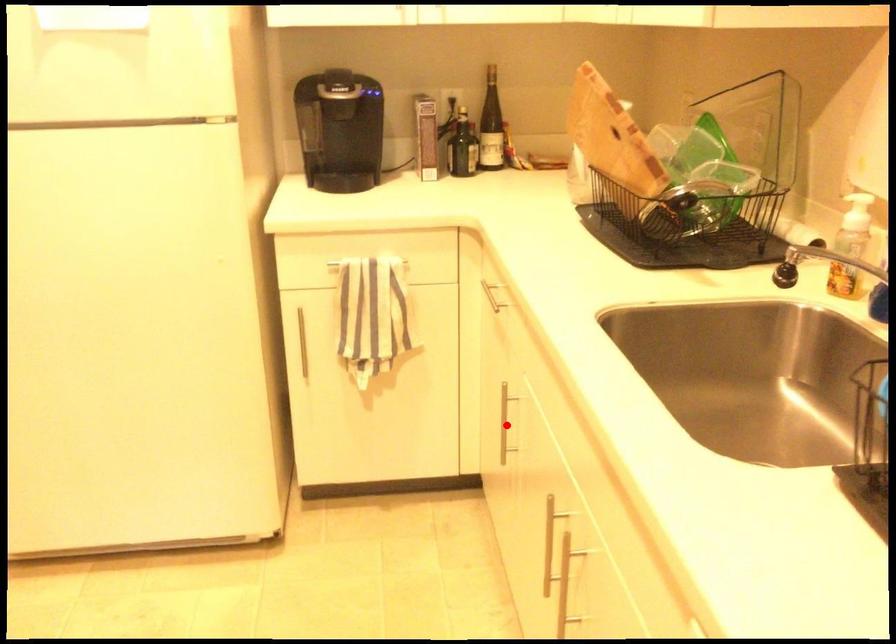
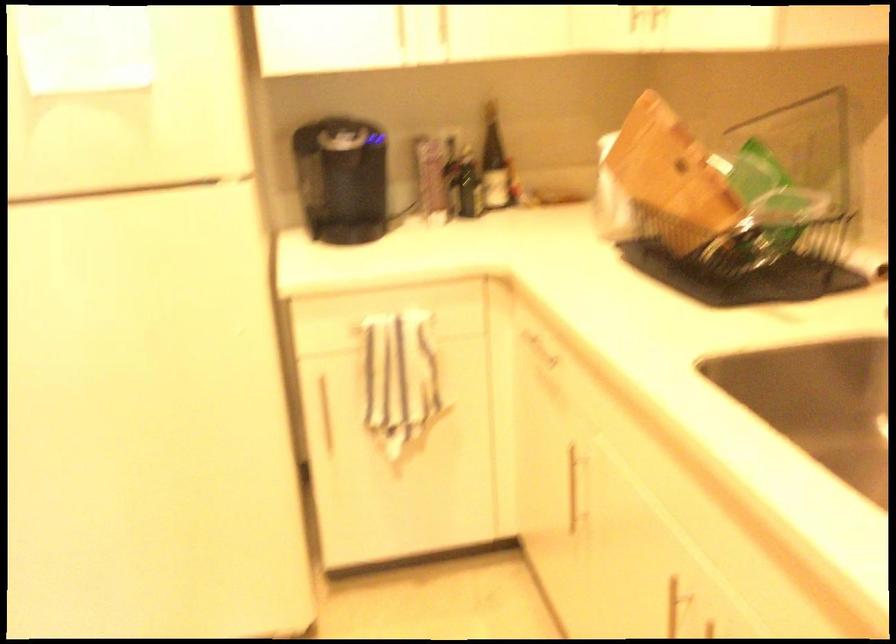
In the second image, find the point that corresponds to the highlighted location in the first image.

(576, 486)